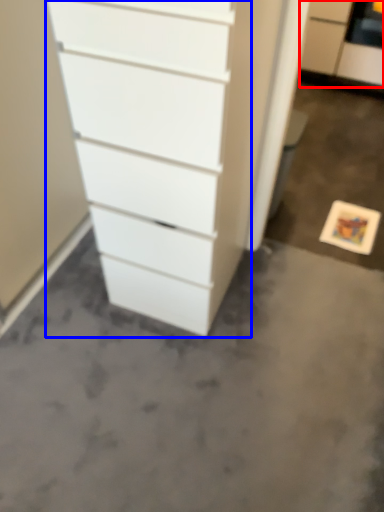
Question: Which of the following is the closest to the observer, filing cabinet (highlighted by a red box) or chest of drawers (highlighted by a blue box)?

Choices:
 (A) filing cabinet
 (B) chest of drawers

Answer: (B)